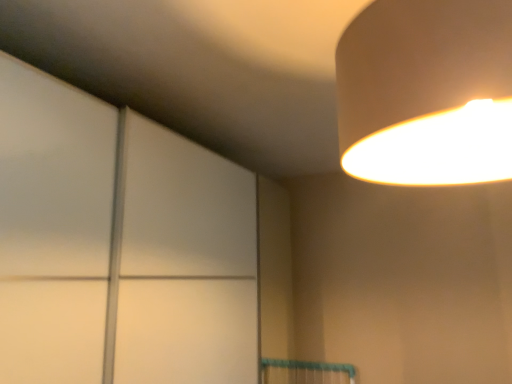
Question: Which is correct: matte white lampshade at upper right is inside transparent glass door at upper left, or outside of it?

Choices:
 (A) outside
 (B) inside

Answer: (A)

Question: Considering the positions of point (428, 3) and point (122, 236), is point (428, 3) closer or farther from the camera than point (122, 236)?

Choices:
 (A) farther
 (B) closer

Answer: (B)

Question: Considering the positions of matte white lampshade at upper right and transparent glass door at upper left in the image, is matte white lampshade at upper right taller or shorter than transparent glass door at upper left?

Choices:
 (A) short
 (B) tall

Answer: (A)

Question: Is point (144, 339) closer or farther from the camera than point (381, 38)?

Choices:
 (A) farther
 (B) closer

Answer: (A)

Question: Considering the relative positions of transparent glass door at upper left and matte white lampshade at upper right in the image provided, is transparent glass door at upper left to the left or to the right of matte white lampshade at upper right?

Choices:
 (A) left
 (B) right

Answer: (A)

Question: Is transparent glass door at upper left inside or outside of matte white lampshade at upper right?

Choices:
 (A) inside
 (B) outside

Answer: (B)

Question: From the image's perspective, relative to matte white lampshade at upper right, is transparent glass door at upper left above or below?

Choices:
 (A) above
 (B) below

Answer: (B)